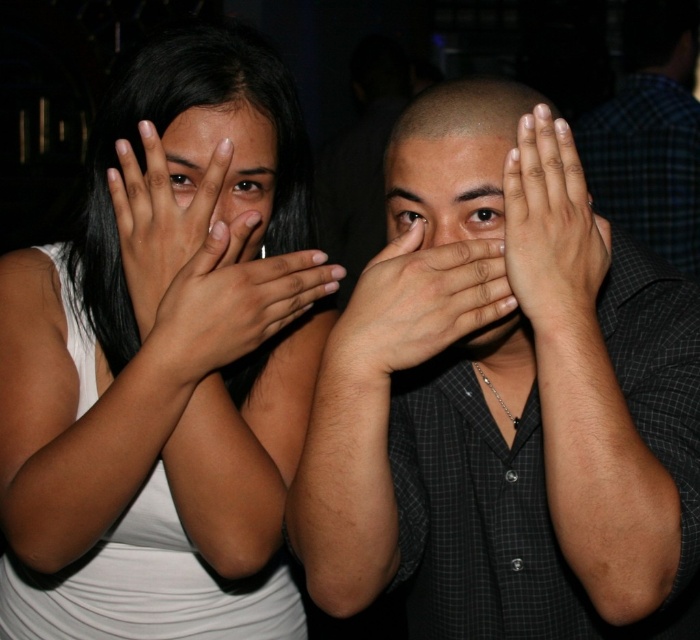
You are a photographer trying to adjust the lighting for a portrait. You notice two features in the frame, the matte skin hand at center and the matte black face at center. Which of these features will likely require more light to be properly exposed due to their inherent reflectivity?

The matte skin hand at center has a greater height compared to matte black face at center, so it will likely require more light to be properly exposed because higher objects may need more light to ensure proper exposure.

Based on the scene description, where is the matte skin hand at center located in terms of coordinates?

The matte skin hand at center is located at coordinates point (175, 220).